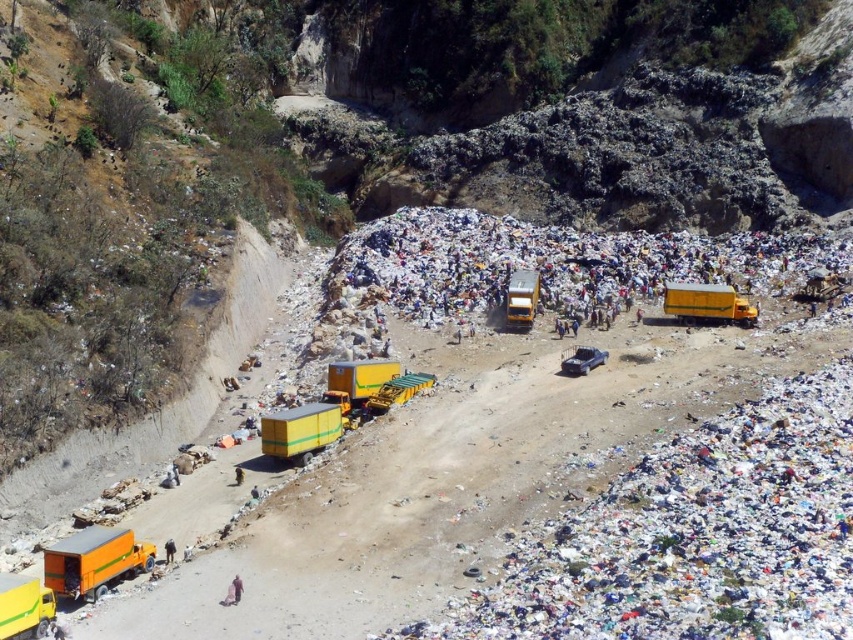
Is orange matte truck at lower left wider than yellow matte truck at lower left?

In fact, orange matte truck at lower left might be narrower than yellow matte truck at lower left.

Does orange matte truck at lower left come in front of yellow matte truck at lower left?

That is False.

Which is behind, point (90, 592) or point (26, 598)?

The point (90, 592) is behind.

The image size is (853, 640). I want to click on orange matte truck at lower left, so click(x=94, y=561).

Is yellow matte truck at lower left further to camera compared to yellow matte truck at center?

That is False.

Where is `yellow matte truck at lower left`? This screenshot has height=640, width=853. yellow matte truck at lower left is located at coordinates (24, 608).

What are the coordinates of `yellow matte truck at lower left` in the screenshot? It's located at (24, 608).

Identify the location of yellow matte truck at lower left. (24, 608).

The image size is (853, 640). What do you see at coordinates (24, 608) in the screenshot?
I see `yellow matte truck at lower left` at bounding box center [24, 608].

Who is positioned more to the left, yellow matte truck at lower left or brown fabric person at lower center?

From the viewer's perspective, yellow matte truck at lower left appears more on the left side.

What do you see at coordinates (24, 608) in the screenshot?
I see `yellow matte truck at lower left` at bounding box center [24, 608].

You are a GUI agent. You are given a task and a screenshot of the screen. Output one action in this format:
    pyautogui.click(x=<x>, y=<y>)
    Task: Click on the yellow matte truck at lower left
    This screenshot has height=640, width=853.
    Given the screenshot: What is the action you would take?
    pyautogui.click(x=24, y=608)